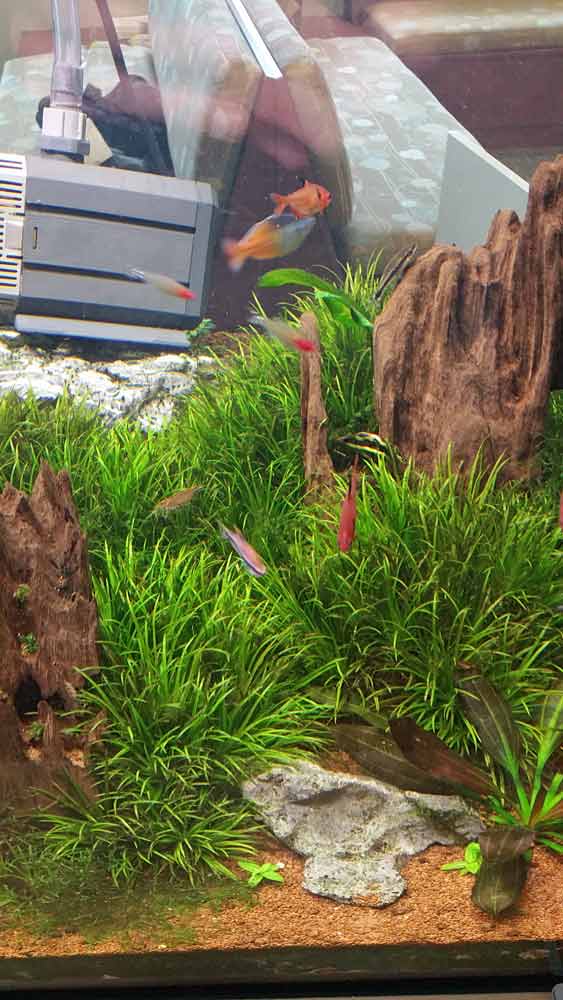
I want to click on couch, so click(377, 108), click(25, 84), click(446, 27).